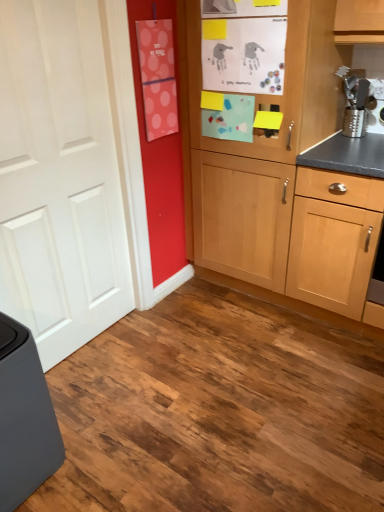
This screenshot has height=512, width=384. In order to click on vacant area that is situated to the right of matte gray trash can at lower left in this screenshot , I will do `click(105, 446)`.